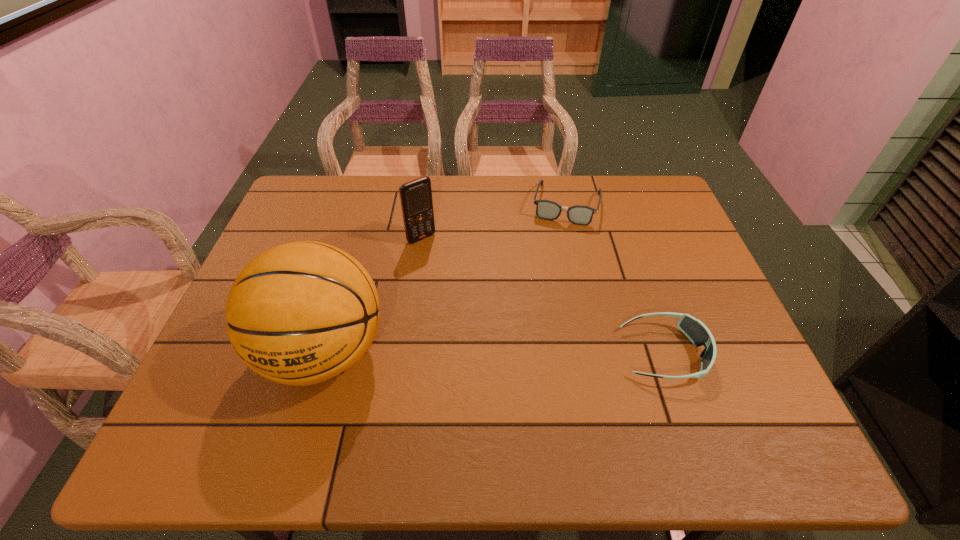
The image size is (960, 540). I want to click on basketball, so click(302, 313).

Where is `goggles`? goggles is located at coordinates (694, 329).

This screenshot has width=960, height=540. Identify the location of the second farthest object. (416, 200).

The image size is (960, 540). I want to click on cellular telephone, so click(416, 200).

Identify the location of the farthest object. The width and height of the screenshot is (960, 540). (581, 215).

Image resolution: width=960 pixels, height=540 pixels. I want to click on free space located 0.050m on the front-facing side of the goggles, so click(x=727, y=354).

Where is `free space located 0.290m on the screen of the cellular telephone`? Image resolution: width=960 pixels, height=540 pixels. free space located 0.290m on the screen of the cellular telephone is located at coordinates (488, 308).

This screenshot has width=960, height=540. I want to click on vacant region located 0.330m on the screen of the cellular telephone, so click(x=497, y=319).

At what (x,y) coordinates should I click in order to perform the action: click on free spot located 0.360m on the screen of the cellular telephone. Please return your answer as a coordinate pair (x, y). The width and height of the screenshot is (960, 540). Looking at the image, I should click on (505, 327).

The height and width of the screenshot is (540, 960). In order to click on vacant space located on the face of the farthest object in this screenshot , I will do `click(548, 285)`.